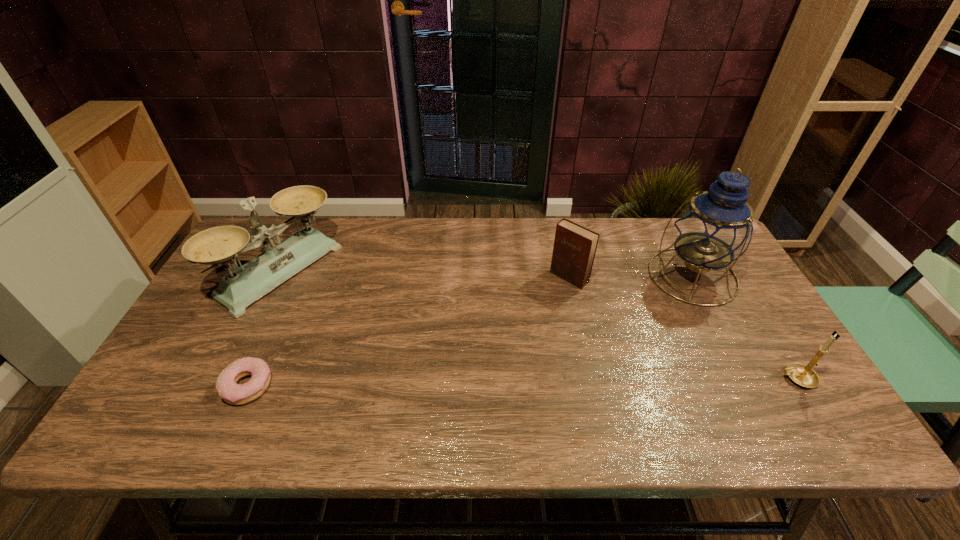
Where is `doughnut that is at the near edge`? This screenshot has width=960, height=540. doughnut that is at the near edge is located at coordinates 226,385.

Identify the location of candle holder situated at the near edge. The image size is (960, 540). (803, 375).

Find the location of a particular element. This screenshot has width=960, height=540. object present at the left edge is located at coordinates (237, 290).

Where is `candle holder that is at the right edge`? candle holder that is at the right edge is located at coordinates (803, 375).

Identify the location of lantern at the right edge. (716, 227).

Identify the location of object located in the far left corner section of the desktop. The height and width of the screenshot is (540, 960). (237, 290).

This screenshot has height=540, width=960. In order to click on object that is at the far right corner in this screenshot , I will do `click(716, 227)`.

What are the coordinates of `object that is at the near right corner` in the screenshot? It's located at coord(803,375).

Locate an element on the screen. The width and height of the screenshot is (960, 540). free space at the far edge of the desktop is located at coordinates (631, 223).

Locate an element on the screen. free space at the near edge is located at coordinates (446, 389).